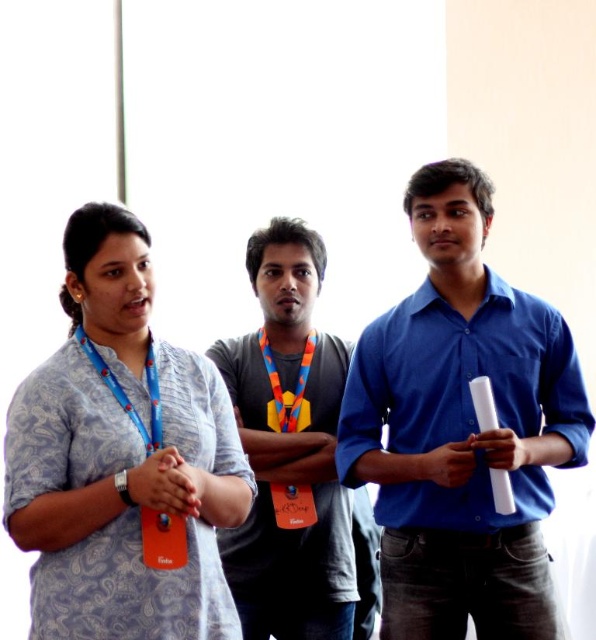
Measure the distance from blue cotton shirt at center to dark gray cotton t-shirt at center.

The distance of blue cotton shirt at center from dark gray cotton t-shirt at center is 47.29 centimeters.

Is point (488, 630) farther from camera compared to point (219, 352)?

No, (488, 630) is in front of (219, 352).

Find the location of a particular element. blue cotton shirt at center is located at coordinates (464, 458).

Does blue fabric lanyard at left lie in front of blue fabric shirt at center?

Yes, blue fabric lanyard at left is in front of blue fabric shirt at center.

Does blue fabric lanyard at left have a larger size compared to blue fabric shirt at center?

Indeed, blue fabric lanyard at left has a larger size compared to blue fabric shirt at center.

This screenshot has height=640, width=596. What do you see at coordinates (125, 394) in the screenshot?
I see `blue fabric lanyard at left` at bounding box center [125, 394].

This screenshot has height=640, width=596. I want to click on blue fabric lanyard at left, so click(x=125, y=394).

Does blue fabric lanyard at left appear over matte blue lanyard at center?

No.

From the picture: Is blue fabric lanyard at left smaller than matte blue lanyard at center?

Actually, blue fabric lanyard at left might be larger than matte blue lanyard at center.

Between point (116, 397) and point (125, 349), which one is positioned behind?

Positioned behind is point (125, 349).

The image size is (596, 640). Identify the location of blue fabric lanyard at left. (125, 394).